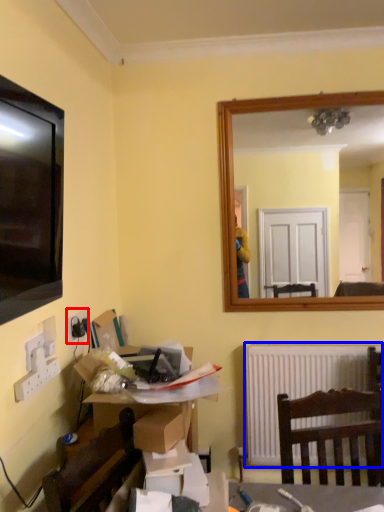
Question: Which object is further to the camera taking this photo, electric outlet (highlighted by a red box) or radiator (highlighted by a blue box)?

Choices:
 (A) electric outlet
 (B) radiator

Answer: (B)